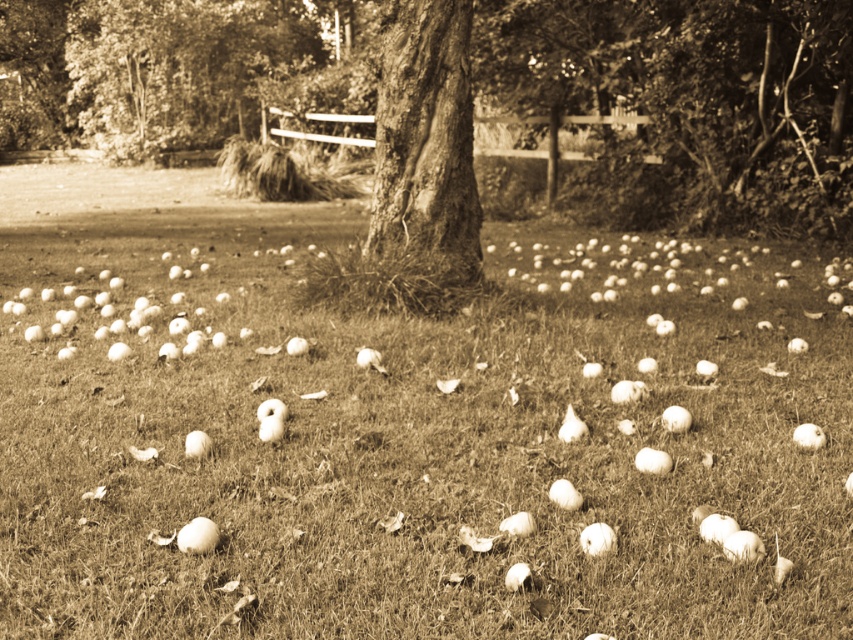
Based on the photo, you are standing in the serene outdoor scene described. You want to place a small decorative statue that is 0.5 meters tall on the smooth grass at center. Considering the distance from where you are standing, will the statue be easily visible to someone standing at your current position?

The smooth grass at center is 2.37 meters away from the viewer. Since the statue is only 0.5 meters tall, it may not be easily visible from that distance due to its small size compared to the distance. It might be better to place it closer or choose a taller statue for better visibility.

Based on the scene description, where is the point located at coordinates (415, 449)?

The point at coordinates (415, 449) is located on the smooth grass at center.